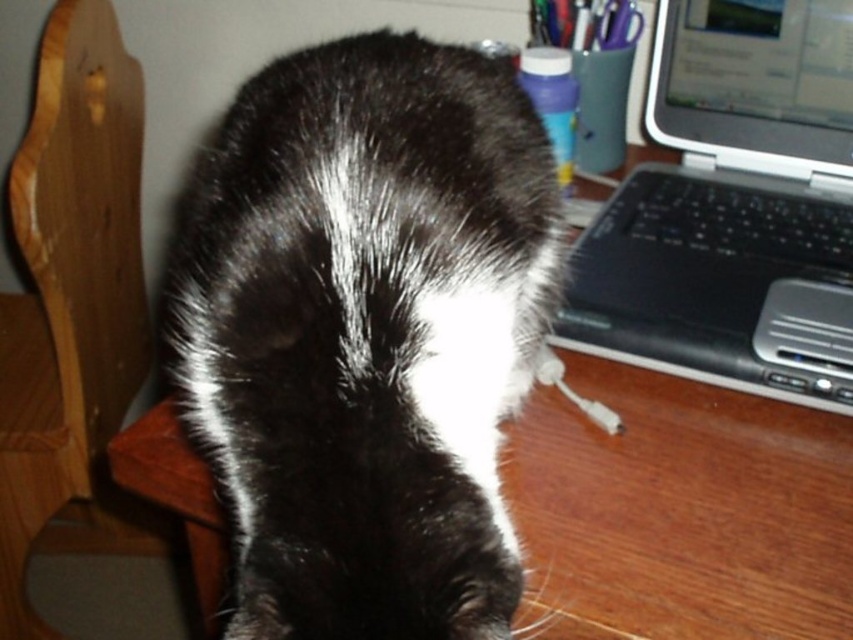
Does black fur cat at center appear on the left side of black plastic laptop at right?

Indeed, black fur cat at center is positioned on the left side of black plastic laptop at right.

Is point (173, 372) behind point (712, 81)?

Yes, it is behind point (712, 81).

Identify the location of black fur cat at center. (366, 333).

Can you confirm if black fur cat at center is positioned below wooden chair at left?

No, black fur cat at center is not below wooden chair at left.

Does point (229, 390) lie in front of point (109, 499)?

Yes, point (229, 390) is closer to viewer.

The image size is (853, 640). Identify the location of black fur cat at center. (366, 333).

Between black plastic laptop at right and wooden chair at left, which one has more height?

wooden chair at left is taller.

Can you confirm if black plastic laptop at right is positioned to the left of wooden chair at left?

No, black plastic laptop at right is not to the left of wooden chair at left.

Which is behind, point (820, 81) or point (49, 67)?

Point (49, 67)

Find the location of a particular element. black plastic laptop at right is located at coordinates (733, 208).